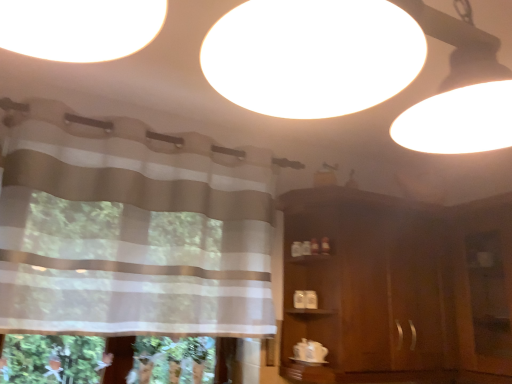
From the picture: Measure the distance between transparent plastic screen door at right and camera.

transparent plastic screen door at right and camera are 1.92 meters apart from each other.

At what (x,y) coordinates should I click in order to perform the action: click on brown wooden dresser at right. Please return your answer as a coordinate pair (x, y). Image resolution: width=512 pixels, height=384 pixels. Looking at the image, I should click on (401, 287).

Consider the image. Is striped fabric curtain at upper left surrounded by transparent plastic screen door at right?

No, striped fabric curtain at upper left is not a part of transparent plastic screen door at right.

Can you confirm if transparent plastic screen door at right is positioned to the left of striped fabric curtain at upper left?

No, transparent plastic screen door at right is not to the left of striped fabric curtain at upper left.

Can you confirm if transparent plastic screen door at right is shorter than striped fabric curtain at upper left?

No.

Is transparent plastic screen door at right directly adjacent to brown wooden dresser at right?

No, transparent plastic screen door at right is not making contact with brown wooden dresser at right.

How far apart are transparent plastic screen door at right and brown wooden dresser at right?

The distance of transparent plastic screen door at right from brown wooden dresser at right is 10.11 inches.

Between transparent plastic screen door at right and brown wooden dresser at right, which one has larger width?

With larger width is brown wooden dresser at right.

Between transparent plastic screen door at right and brown wooden dresser at right, which one is positioned behind?

Positioned behind is brown wooden dresser at right.

Can you tell me how much brown wooden dresser at right and striped fabric curtain at upper left differ in facing direction?

The facing directions of brown wooden dresser at right and striped fabric curtain at upper left are 7.93 degrees apart.

In the image, there is a striped fabric curtain at upper left. At what (x,y) coordinates should I click in order to perform the action: click on dresser below it (from the image's perspective). Please return your answer as a coordinate pair (x, y). This screenshot has height=384, width=512. Looking at the image, I should click on (401, 287).

Looking at this image, from a real-world perspective, is brown wooden dresser at right positioned above or below striped fabric curtain at upper left?

brown wooden dresser at right is below striped fabric curtain at upper left.

Is brown wooden dresser at right behind striped fabric curtain at upper left?

Yes, it is behind striped fabric curtain at upper left.

Is striped fabric curtain at upper left oriented away from transparent plastic screen door at right?

No, transparent plastic screen door at right is not at the back of striped fabric curtain at upper left.

Locate an element on the screen. The image size is (512, 384). curtain that appears above the transparent plastic screen door at right (from the image's perspective) is located at coordinates (130, 229).

From the picture: Can you confirm if striped fabric curtain at upper left is positioned to the right of transparent plastic screen door at right?

Incorrect, striped fabric curtain at upper left is not on the right side of transparent plastic screen door at right.

In terms of height, does striped fabric curtain at upper left look taller or shorter compared to transparent plastic screen door at right?

Clearly, striped fabric curtain at upper left is shorter compared to transparent plastic screen door at right.

Find the location of a particular element. This screenshot has height=384, width=512. screen door lying on the right of brown wooden dresser at right is located at coordinates (487, 301).

Who is shorter, brown wooden dresser at right or transparent plastic screen door at right?

Standing shorter between the two is transparent plastic screen door at right.

Is brown wooden dresser at right not close to transparent plastic screen door at right?

No.

Is brown wooden dresser at right not inside transparent plastic screen door at right?

Yes, brown wooden dresser at right is located beyond the bounds of transparent plastic screen door at right.

Are striped fabric curtain at upper left and brown wooden dresser at right making contact?

They are not placed beside each other.

Considering the sizes of objects striped fabric curtain at upper left and brown wooden dresser at right in the image provided, who is wider, striped fabric curtain at upper left or brown wooden dresser at right?

Wider between the two is brown wooden dresser at right.

From the image's perspective, would you say striped fabric curtain at upper left is positioned over brown wooden dresser at right?

Yes.

What's the angular difference between striped fabric curtain at upper left and brown wooden dresser at right's facing directions?

7.93 degrees separate the facing orientations of striped fabric curtain at upper left and brown wooden dresser at right.

In the image, there is a transparent plastic screen door at right. Identify the location of curtain above it (from the image's perspective). This screenshot has height=384, width=512. (130, 229).

Find the location of a particular element. screen door below the brown wooden dresser at right (from the image's perspective) is located at coordinates (487, 301).

Looking at this image, when comparing their distances from transparent plastic screen door at right, does striped fabric curtain at upper left or brown wooden dresser at right seem closer?

brown wooden dresser at right lies closer to transparent plastic screen door at right than the other object.

Looking at this image, which object lies nearer to the anchor point brown wooden dresser at right, striped fabric curtain at upper left or transparent plastic screen door at right?

Among the two, transparent plastic screen door at right is located nearer to brown wooden dresser at right.

Looking at the image, which one is located closer to brown wooden dresser at right, transparent plastic screen door at right or striped fabric curtain at upper left?

transparent plastic screen door at right lies closer to brown wooden dresser at right than the other object.

From the image, which object appears to be nearer to striped fabric curtain at upper left, brown wooden dresser at right or transparent plastic screen door at right?

Among the two, brown wooden dresser at right is located nearer to striped fabric curtain at upper left.

Looking at the image, which one is located further to transparent plastic screen door at right, brown wooden dresser at right or striped fabric curtain at upper left?

striped fabric curtain at upper left is positioned further to the anchor transparent plastic screen door at right.

Looking at the image, which one is located further to striped fabric curtain at upper left, transparent plastic screen door at right or brown wooden dresser at right?

transparent plastic screen door at right.

In order to click on dresser between striped fabric curtain at upper left and transparent plastic screen door at right from left to right in this screenshot , I will do `click(401, 287)`.